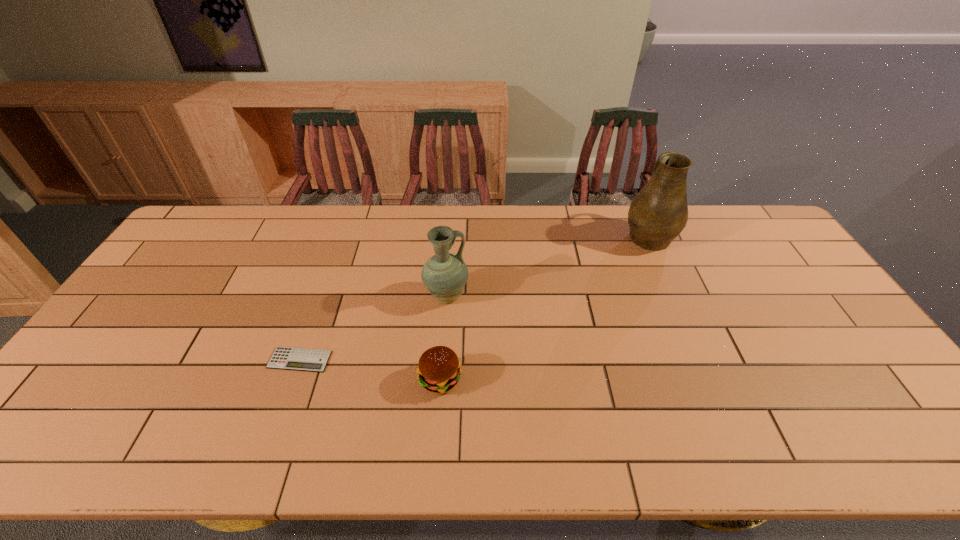
Identify the location of object that is positioned at the far edge. (659, 212).

I want to click on vacant space at the far edge, so click(725, 247).

Locate an element on the screen. The width and height of the screenshot is (960, 540). free region at the near edge of the desktop is located at coordinates (467, 424).

Where is `vacant area at the right edge of the desktop`? vacant area at the right edge of the desktop is located at coordinates (821, 298).

Where is `vacant area at the far left corner`? Image resolution: width=960 pixels, height=540 pixels. vacant area at the far left corner is located at coordinates (216, 244).

Where is `free space between the leftmost object and the hamburger`? free space between the leftmost object and the hamburger is located at coordinates (370, 370).

Find the location of a particular element. free space between the third tallest object and the second farthest object is located at coordinates (444, 338).

Where is `empty location between the second shortest object and the shorter pitcher`? empty location between the second shortest object and the shorter pitcher is located at coordinates (444, 338).

This screenshot has width=960, height=540. I want to click on vacant area that lies between the third tallest object and the right pitcher, so click(x=544, y=308).

The width and height of the screenshot is (960, 540). I want to click on vacant point located between the farther pitcher and the leftmost object, so click(474, 298).